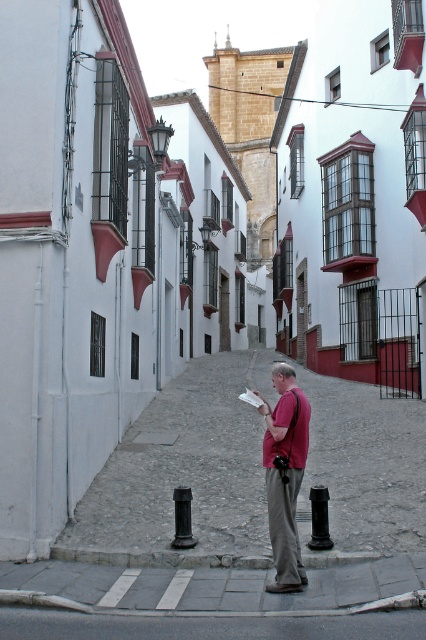
You are standing at the entrance of the smooth stone alley at center and want to take a photo of the entire alley using a camera with a 50mm lens. Considering the camera is at eye level, which is 5 feet above the ground, can you capture the entire alley in one shot without moving? Explain your reasoning.

The smooth stone alley at center is 27.26 feet away from the camera. With a 50mm lens, the field of view is typically wide enough to capture the alley at this distance, especially since the camera is positioned at the entrance. The 5 feet eye level height may not affect the ability to capture the entire alley horizontally, so it should be possible to take the photo without moving.

You are a delivery drone with a wingspan of 1.2 meters. You need to fly through the narrow space between the smooth stone alley at center and the black glossy pole at center. Can your drone safely pass through this space?

The smooth stone alley at center is 4.61 meters away from the black glossy pole at center. Since the drone has a wingspan of 1.2 meters, there is more than enough space for it to pass safely between them.

You are a tourist in a Mediterranean town and you want to take a photo of the smooth stone alley at center and the black matte pole at lower center. Which one should you focus on first if you want to capture both in the frame?

The smooth stone alley at center is positioned on the right side of black matte pole at lower center, so you should focus on the black matte pole at lower center first to ensure both are in the frame.